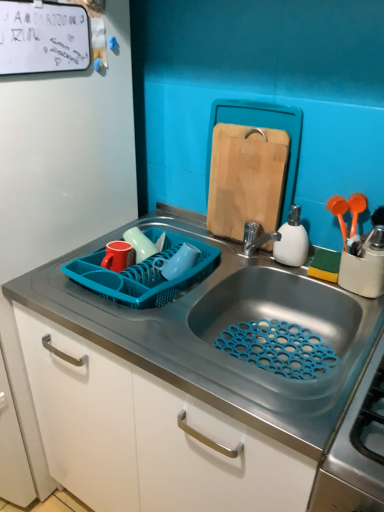
Where is `vacant space in front of white matte soap dispenser at right`? vacant space in front of white matte soap dispenser at right is located at coordinates (317, 287).